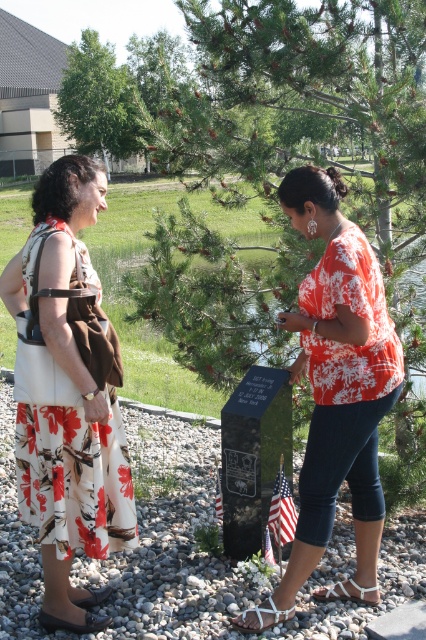
Question: From the image, what is the correct spatial relationship of green textured pine tree at center in relation to white fabric sandal at lower left?

Choices:
 (A) right
 (B) left

Answer: (A)

Question: Is green textured pine tree at center in front of brown leather sandal at lower left?

Choices:
 (A) yes
 (B) no

Answer: (B)

Question: Which point appears farthest from the camera in this image?

Choices:
 (A) (63, 92)
 (B) (81, 605)
 (C) (377, 596)
 (D) (402, 42)

Answer: (A)

Question: Which point is closer to the camera taking this photo?

Choices:
 (A) [307, 570]
 (B) [40, 618]
 (C) [86, 604]

Answer: (A)

Question: Which of the following is the farthest from the observer?

Choices:
 (A) orange floral blouse at center
 (B) green textured pine tree at center
 (C) white fabric sandal at lower center

Answer: (B)

Question: Does white floral dress at left have a lesser width compared to brown leather sandal at lower left?

Choices:
 (A) no
 (B) yes

Answer: (A)